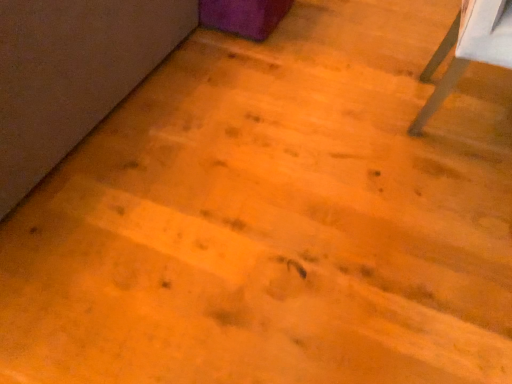
Locate an element on the screen. Image resolution: width=512 pixels, height=384 pixels. unoccupied area behind wooden table at right is located at coordinates (412, 45).